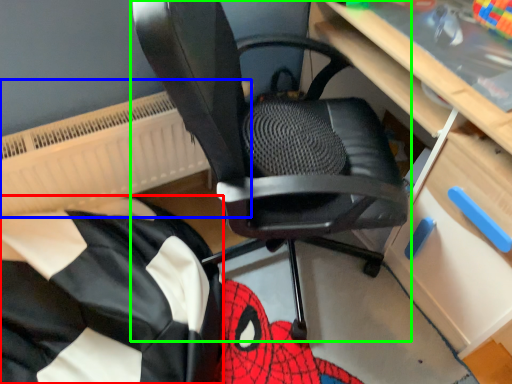
Question: Which object is positioned closest to bean bag chair (highlighted by a red box)? Select from radiator (highlighted by a blue box) and chair (highlighted by a green box).

Choices:
 (A) radiator
 (B) chair

Answer: (A)